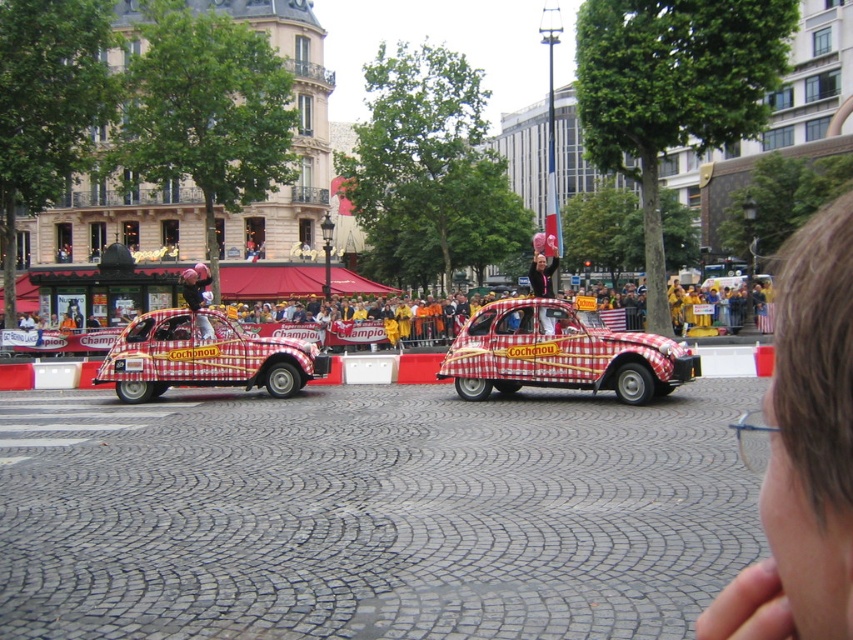
You are a photographer at the event and want to capture both the brown hair at upper right and the matte red car at center in a single shot. Based on their positions, which object should you position closer to the left side of your camera frame?

The matte red car at center should be positioned closer to the left side of your camera frame because the brown hair at upper right is to the right of it.

You are a participant in the parade and need to position your float exactly where the matte red car at center is currently located. According to the provided coordinates, what are the exact coordinates where you should place your float?

The exact coordinates for the matte red car at center are at point (541, 268), so you should place your float there.